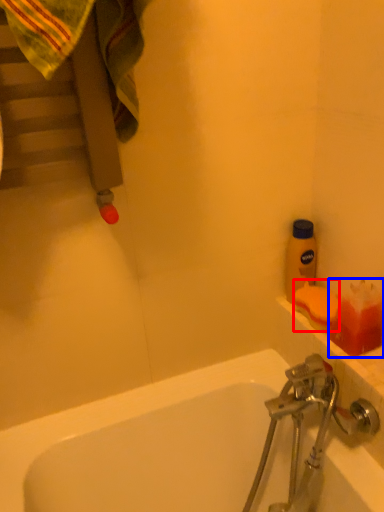
Question: Among these objects, which one is nearest to the camera, soap (highlighted by a red box) or toiletry (highlighted by a blue box)?

Choices:
 (A) soap
 (B) toiletry

Answer: (B)